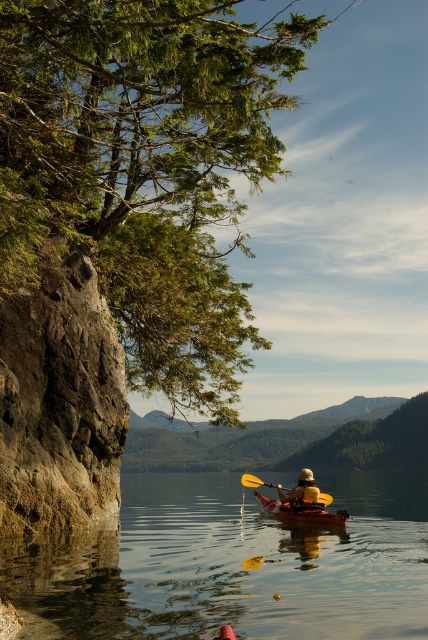
You are standing on the rugged cliff face on the left side of the image and want to throw a lifebuoy to the orange plastic kayak at center. Given that the lifebuoy can travel 100 feet, will it reach the kayak?

The orange plastic kayak at center and viewer are 106.68 feet apart. Since the lifebuoy can only travel 100 feet, it will not reach the kayak.

You are a drone operator trying to capture the kayaker in the red kayak. The drone is currently hovering above the clear water at center. To get a better shot, you need to move the drone to the right by 0.1 units. What coordinate will the drone be at after moving?

The clear water at center is at point (232, 563). Moving the drone to the right by 0.1 units would add 0.1 to the x coordinate. The new coordinate would be (232, 627).

You are a photographer trying to capture the reflection of the clear water at center in your shot. Since the yellow foam kayak at center is blocking part of the water, can you move the kayak backward so that the water becomes visible behind it?

The clear water at center is in front of the yellow foam kayak at center, so moving the kayak backward would not reveal more of the water behind it. The water is already positioned in front of the kayak.